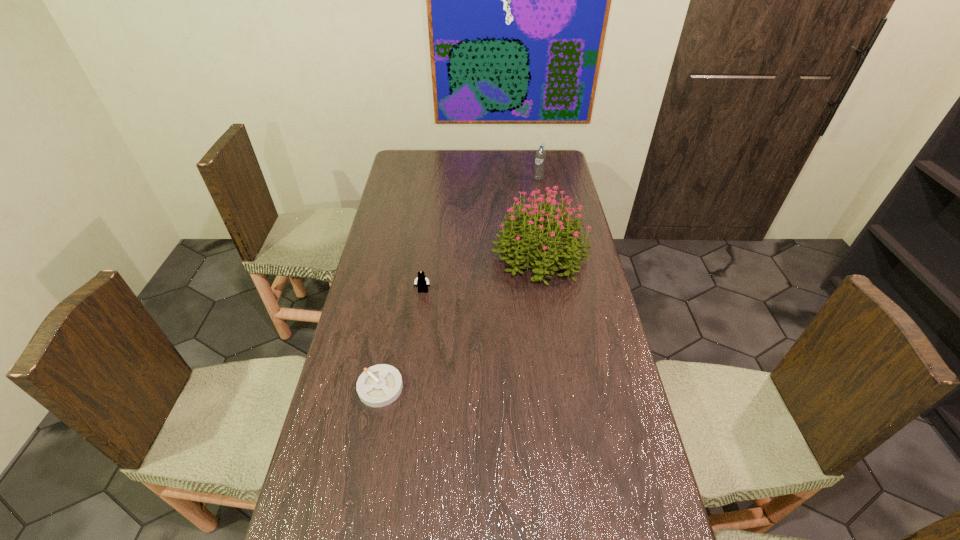
Locate an element on the screen. The image size is (960, 540). object that stands as the closest to the nearest object is located at coordinates (422, 281).

Locate which object ranks second in proximity to the water bottle. Please provide its 2D coordinates. Your answer should be formatted as a tuple, i.e. [(x, y)], where the tuple contains the x and y coordinates of a point satisfying the conditions above.

[(422, 281)]

This screenshot has width=960, height=540. I want to click on vacant area in the image that satisfies the following two spatial constraints: 1. on the back side of the third shortest object; 2. on the left side of the nearest object, so click(420, 179).